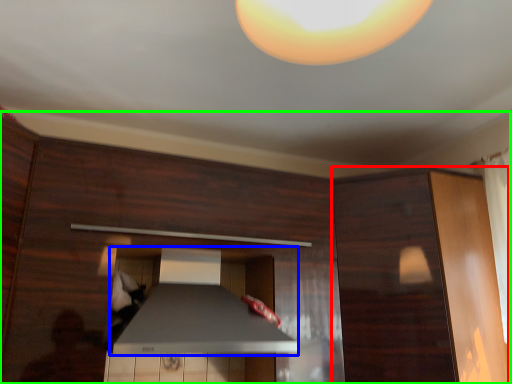
Question: Which object is the farthest from cabinetry (highlighted by a red box)? Choose among these: exhaust hood (highlighted by a blue box) or dresser (highlighted by a green box).

Choices:
 (A) exhaust hood
 (B) dresser

Answer: (A)